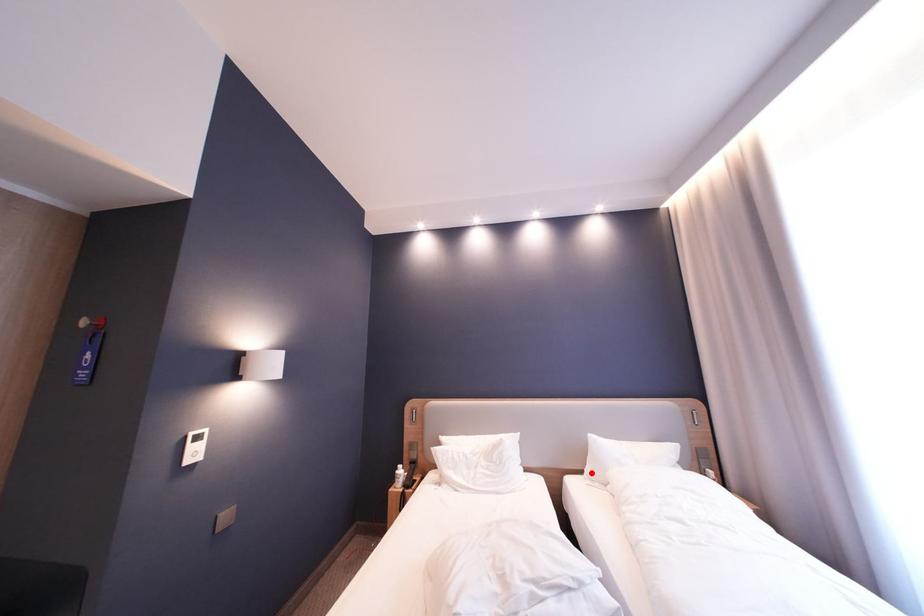
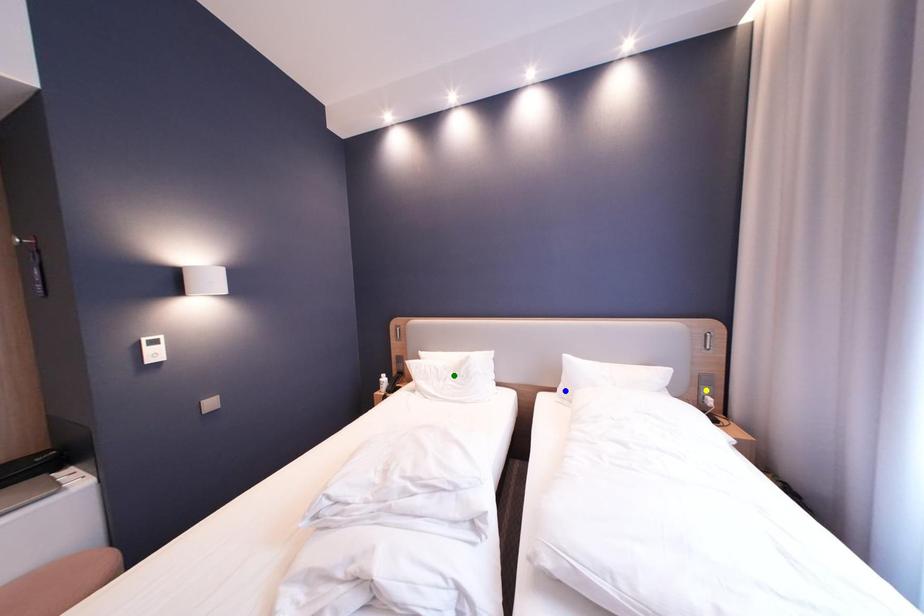
Question: I am providing you with two images of the same scene from different viewpoints. A red point is marked on the first image. You are given multiple points on the second image. Can you choose the point in image 2 that corresponds to the point in image 1?

Choices:
 (A) blue point
 (B) yellow point
 (C) green point

Answer: (A)